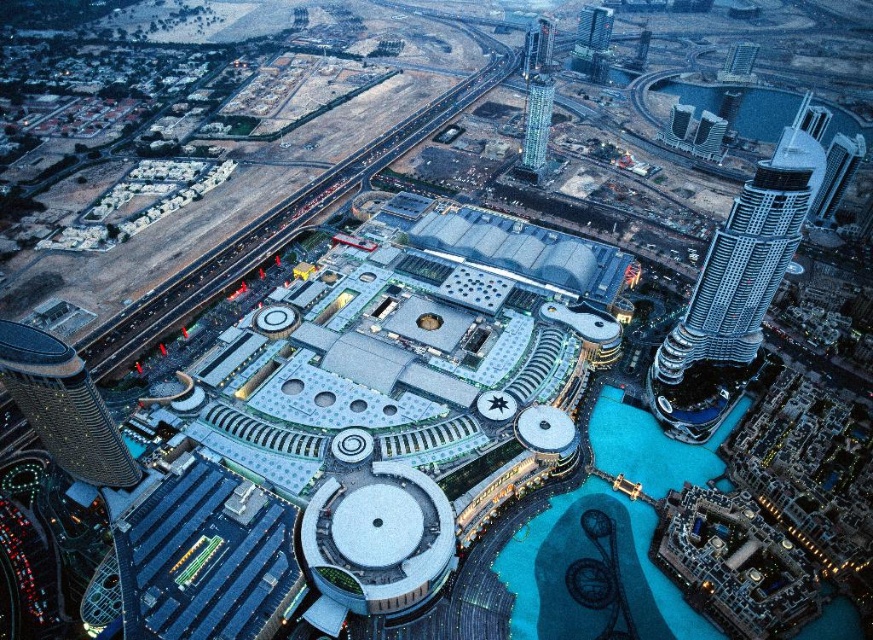
Question: Which of the following is the closest to the observer?

Choices:
 (A) (748, 275)
 (B) (520, 172)

Answer: (A)

Question: Is the position of silver metallic skyscraper at right more distant than that of glassy skyscraper at upper center?

Choices:
 (A) no
 (B) yes

Answer: (A)

Question: Does silver metallic skyscraper at right have a smaller size compared to glassy skyscraper at upper center?

Choices:
 (A) no
 (B) yes

Answer: (A)

Question: Is silver metallic skyscraper at right to the left of glassy skyscraper at upper center from the viewer's perspective?

Choices:
 (A) no
 (B) yes

Answer: (A)